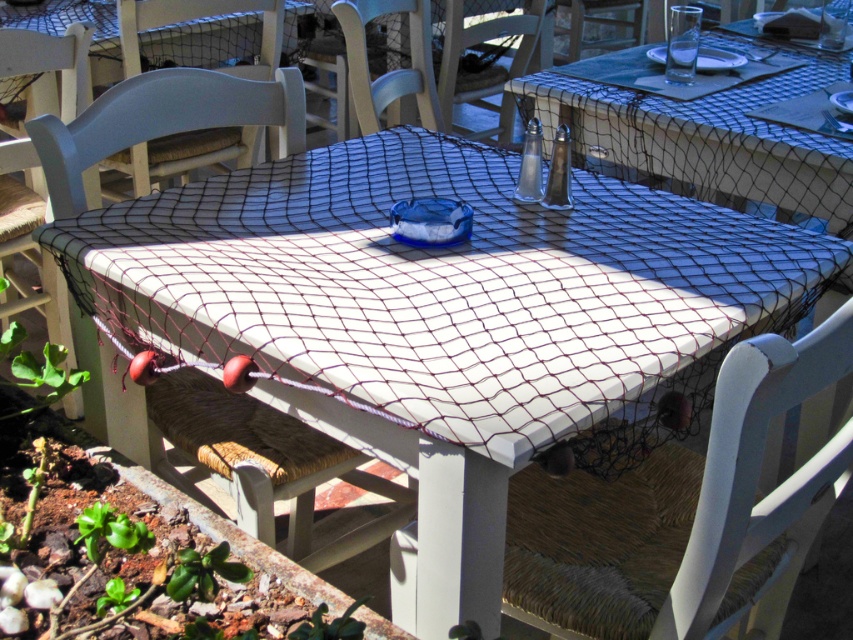
Question: Among these points, which one is farthest from the camera?

Choices:
 (A) (119, 83)
 (B) (421, 88)

Answer: (B)

Question: Does white wicker chair at center have a smaller size compared to white woven chair at center?

Choices:
 (A) yes
 (B) no

Answer: (B)

Question: Does white wicker chair at upper center have a greater width compared to metallic silver salt shaker at upper center?

Choices:
 (A) no
 (B) yes

Answer: (B)

Question: Is the position of white wicker chair at lower left less distant than that of white woven chair at center?

Choices:
 (A) yes
 (B) no

Answer: (A)

Question: Based on their relative distances, which object is nearer to the white wicker chair at lower left?

Choices:
 (A) metallic silver salt shaker at upper center
 (B) white wicker chair at lower right
 (C) white woven chair at center
 (D) wooden chair at center

Answer: (C)

Question: Among these objects, which one is nearest to the camera?

Choices:
 (A) white wicker chair at center
 (B) metallic silver salt shaker at upper center
 (C) white woven chair at center
 (D) wooden chair at center

Answer: (A)